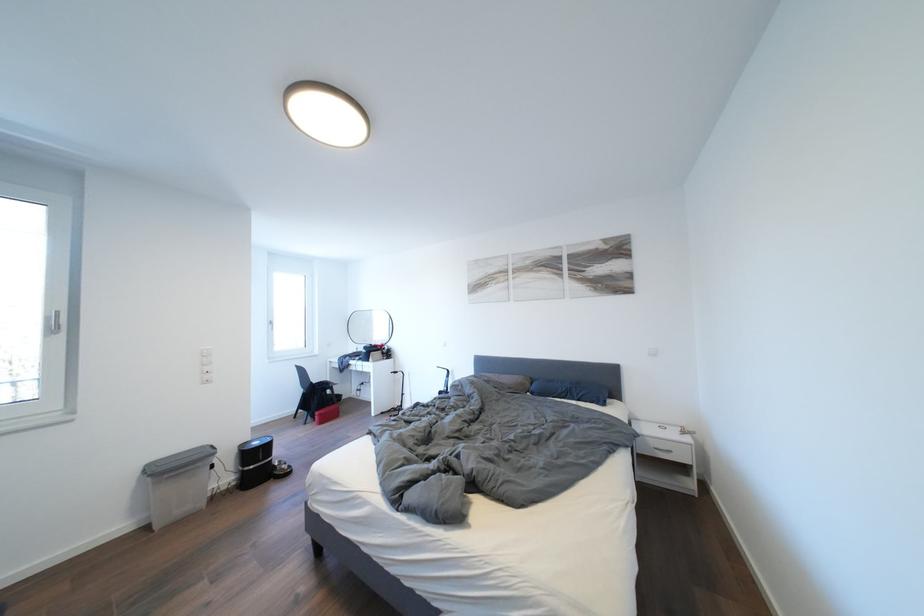
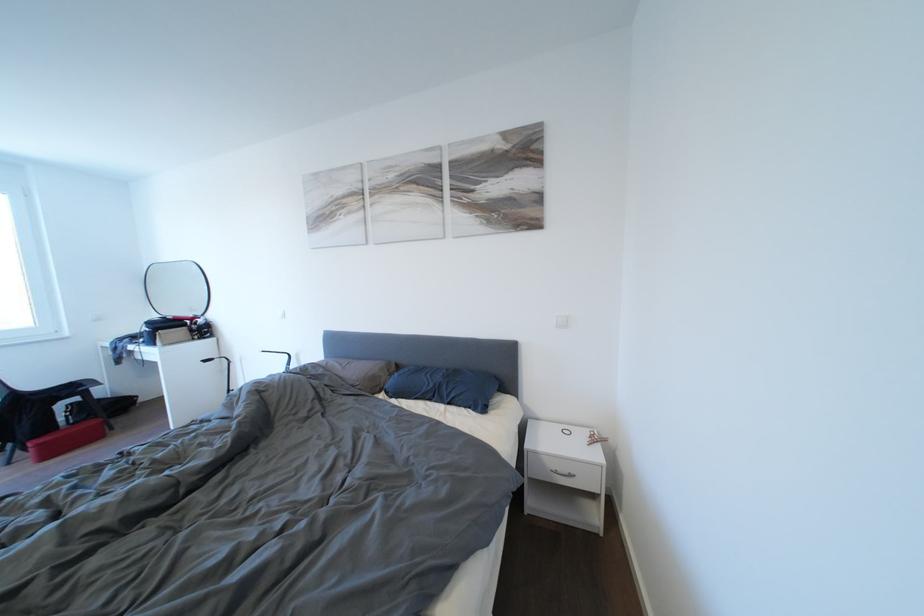
What movement of the cameraman would produce the second image?

The cameraman walked toward right, forward.